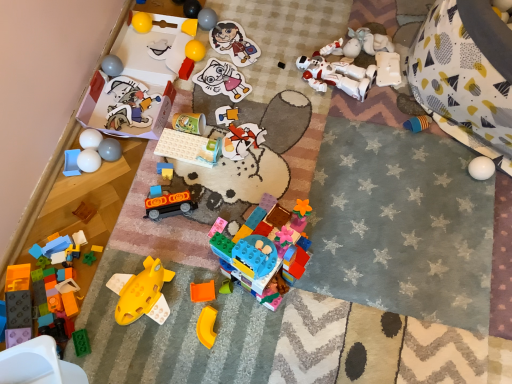
Locate an element on the screen. This screenshot has height=384, width=512. free space that is in between orange matte toy airplane at center, which is the eighth toy from right to left, and smooth yellow ball at upper center, which is the 15th toy from left to right is located at coordinates (206, 145).